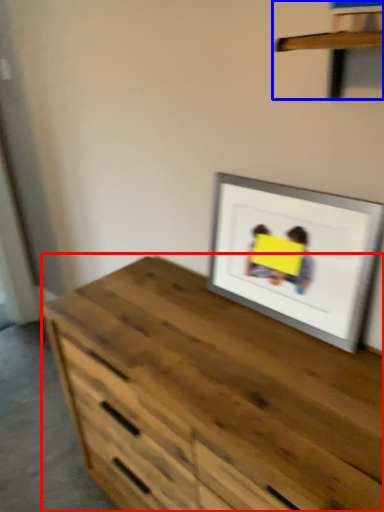
Question: Among these objects, which one is farthest to the camera, chest of drawers (highlighted by a red box) or shelf (highlighted by a blue box)?

Choices:
 (A) chest of drawers
 (B) shelf

Answer: (A)